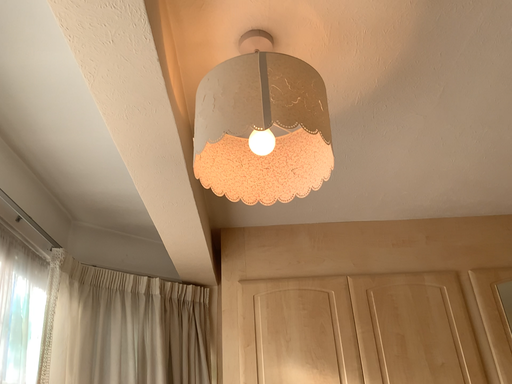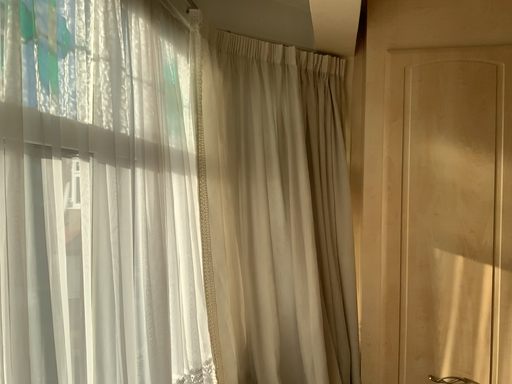
Question: How did the camera likely rotate when shooting the video?

Choices:
 (A) rotated downward
 (B) rotated upward

Answer: (A)